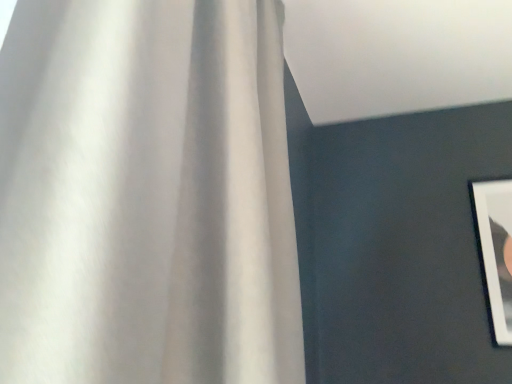
Question: Is white matte curtain at upper left oriented towards white glossy picture frame at right?

Choices:
 (A) yes
 (B) no

Answer: (B)

Question: Considering the relative sizes of white matte curtain at upper left and white glossy picture frame at right in the image provided, is white matte curtain at upper left taller than white glossy picture frame at right?

Choices:
 (A) yes
 (B) no

Answer: (A)

Question: Considering the relative sizes of white matte curtain at upper left and white glossy picture frame at right in the image provided, is white matte curtain at upper left shorter than white glossy picture frame at right?

Choices:
 (A) no
 (B) yes

Answer: (A)

Question: Can we say white matte curtain at upper left lies outside white glossy picture frame at right?

Choices:
 (A) no
 (B) yes

Answer: (B)

Question: Considering the relative positions of white matte curtain at upper left and white glossy picture frame at right in the image provided, is white matte curtain at upper left in front of white glossy picture frame at right?

Choices:
 (A) no
 (B) yes

Answer: (B)

Question: Does white matte curtain at upper left have a lesser width compared to white glossy picture frame at right?

Choices:
 (A) no
 (B) yes

Answer: (A)

Question: Is white glossy picture frame at right thinner than white matte curtain at upper left?

Choices:
 (A) no
 (B) yes

Answer: (B)

Question: Is white glossy picture frame at right outside white matte curtain at upper left?

Choices:
 (A) no
 (B) yes

Answer: (B)

Question: Does white glossy picture frame at right have a smaller size compared to white matte curtain at upper left?

Choices:
 (A) yes
 (B) no

Answer: (A)

Question: Is white glossy picture frame at right directly adjacent to white matte curtain at upper left?

Choices:
 (A) no
 (B) yes

Answer: (A)

Question: Is white glossy picture frame at right at the left side of white matte curtain at upper left?

Choices:
 (A) no
 (B) yes

Answer: (A)

Question: Could you tell me if white glossy picture frame at right is turned towards white matte curtain at upper left?

Choices:
 (A) no
 (B) yes

Answer: (A)

Question: Is white glossy picture frame at right wider or thinner than white matte curtain at upper left?

Choices:
 (A) thin
 (B) wide

Answer: (A)